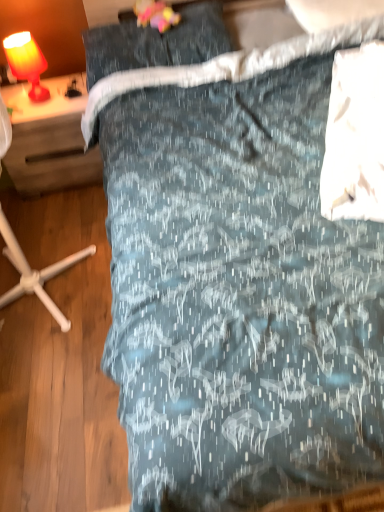
Question: Does matte orange lamp at upper left contain matte wood desk at left?

Choices:
 (A) no
 (B) yes

Answer: (A)

Question: Is matte orange lamp at upper left completely or partially outside of matte wood desk at left?

Choices:
 (A) no
 (B) yes

Answer: (B)

Question: Does matte orange lamp at upper left have a larger size compared to matte wood desk at left?

Choices:
 (A) yes
 (B) no

Answer: (B)

Question: Can you confirm if matte orange lamp at upper left is wider than matte wood desk at left?

Choices:
 (A) yes
 (B) no

Answer: (B)

Question: From the image's perspective, is matte orange lamp at upper left under matte wood desk at left?

Choices:
 (A) no
 (B) yes

Answer: (A)

Question: From a real-world perspective, is matte orange lamp at upper left above or below matte wood desk at left?

Choices:
 (A) above
 (B) below

Answer: (A)

Question: From the image's perspective, relative to matte wood desk at left, is matte orange lamp at upper left above or below?

Choices:
 (A) below
 (B) above

Answer: (B)

Question: Is point (34, 96) positioned closer to the camera than point (34, 192)?

Choices:
 (A) farther
 (B) closer

Answer: (B)

Question: Looking at the image, does matte orange lamp at upper left seem bigger or smaller compared to matte wood desk at left?

Choices:
 (A) big
 (B) small

Answer: (B)

Question: In the image, is dark gray fabric pillow at upper center positioned in front of or behind matte wood desk at left?

Choices:
 (A) behind
 (B) front

Answer: (B)

Question: From a real-world perspective, is dark gray fabric pillow at upper center above or below matte wood desk at left?

Choices:
 (A) above
 (B) below

Answer: (A)

Question: Is dark gray fabric pillow at upper center situated inside matte wood desk at left or outside?

Choices:
 (A) outside
 (B) inside

Answer: (A)

Question: Is dark gray fabric pillow at upper center to the left or to the right of matte wood desk at left in the image?

Choices:
 (A) left
 (B) right

Answer: (B)

Question: In terms of width, does matte wood desk at left look wider or thinner when compared to dark gray fabric pillow at upper center?

Choices:
 (A) thin
 (B) wide

Answer: (B)

Question: From a real-world perspective, is matte wood desk at left physically located above or below dark gray fabric pillow at upper center?

Choices:
 (A) below
 (B) above

Answer: (A)